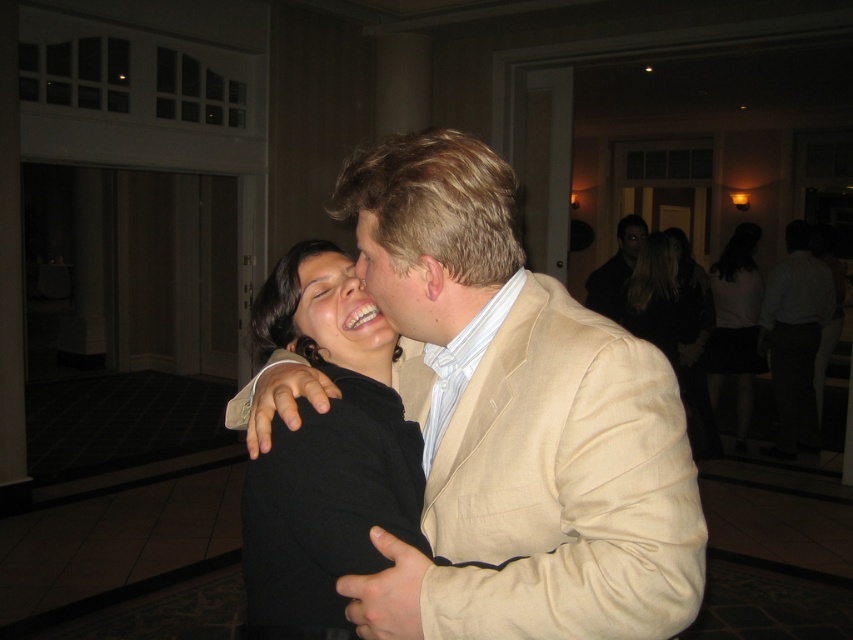
Question: Is beige linen suit at center to the left of black fabric dress at center from the viewer's perspective?

Choices:
 (A) yes
 (B) no

Answer: (A)

Question: Is beige linen suit at center positioned at the back of black fabric skirt at right?

Choices:
 (A) no
 (B) yes

Answer: (A)

Question: Which point is closer to the camera taking this photo?

Choices:
 (A) (306, 355)
 (B) (738, 243)
 (C) (741, 369)

Answer: (A)

Question: Estimate the real-world distances between objects in this image. Which object is farther from the black fabric dress at center?

Choices:
 (A) black cotton shirt at upper right
 (B) black fabric skirt at right
 (C) light beige suit at right
 (D) beige linen suit at right

Answer: (D)

Question: Which of the following is the farthest from the observer?

Choices:
 (A) light beige suit at right
 (B) beige linen suit at right

Answer: (B)

Question: Can you confirm if beige linen suit at center is positioned above black soft fabric at center?

Choices:
 (A) yes
 (B) no

Answer: (A)